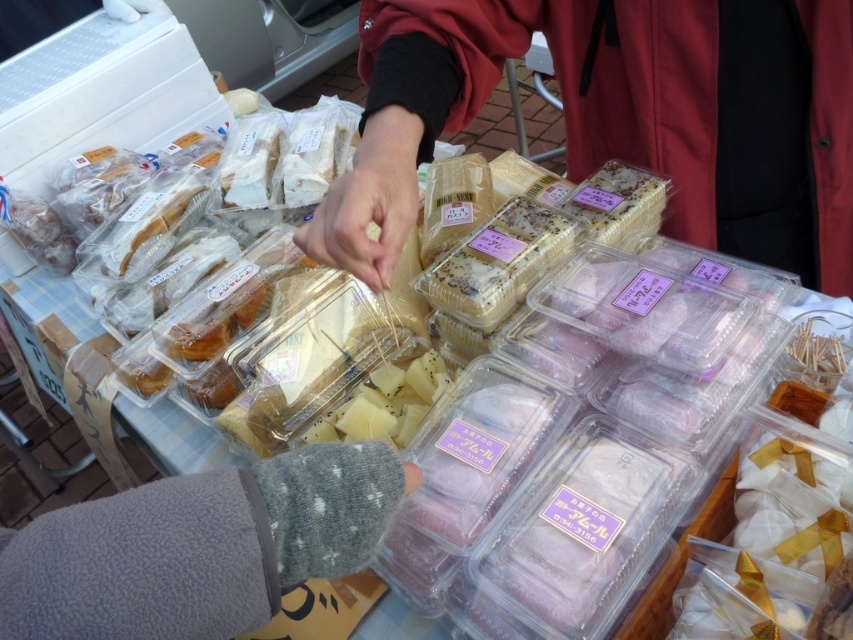
Between smooth red jacket at center and gray fleece glove at lower left, which one has more height?

smooth red jacket at center is taller.

Does smooth red jacket at center appear under gray fleece glove at lower left?

No.

Who is more distant from viewer, (x=664, y=129) or (x=84, y=604)?

The point (x=664, y=129) is behind.

This screenshot has height=640, width=853. What are the coordinates of `smooth red jacket at center` in the screenshot? It's located at (624, 116).